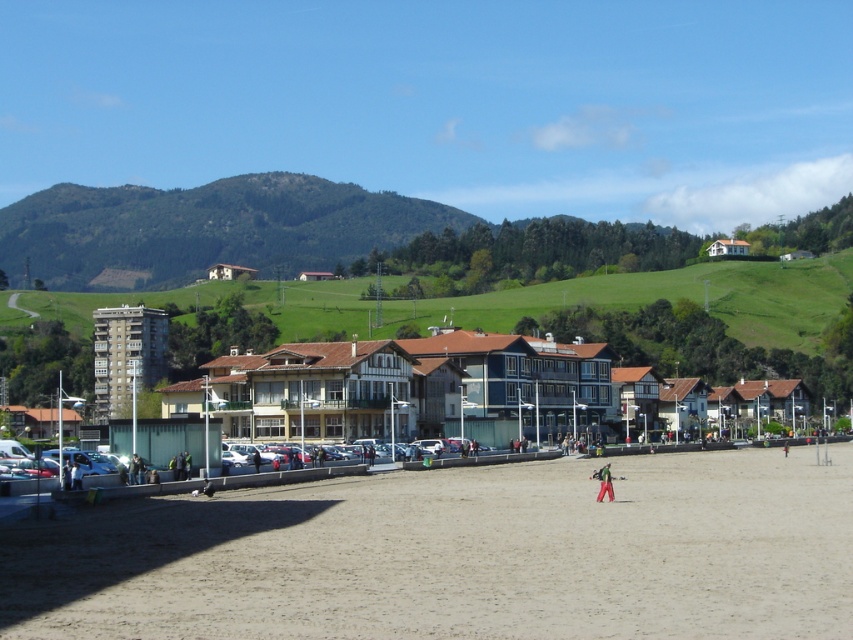
Question: Which point is closer to the camera?

Choices:
 (A) (114, 364)
 (B) (16, 266)
 (C) (618, 516)

Answer: (C)

Question: Can you confirm if green grassy hillside at upper center is bigger than white wooden house at center?

Choices:
 (A) no
 (B) yes

Answer: (B)

Question: Considering the relative positions of light brown sand at center and white wooden house at center in the image provided, where is light brown sand at center located with respect to white wooden house at center?

Choices:
 (A) right
 (B) left

Answer: (B)

Question: Is green grassy hillside at upper center further to the viewer compared to white wooden house at center?

Choices:
 (A) no
 (B) yes

Answer: (B)

Question: Which object is the closest to the brown wooden house at center?

Choices:
 (A) white wooden house at center
 (B) gray concrete building at left
 (C) green grassy hillside at upper center

Answer: (C)

Question: Which object is closer to the camera taking this photo?

Choices:
 (A) gray concrete building at left
 (B) red fabric pants at center
 (C) green grassy hillside at upper center
 (D) white wooden house at center

Answer: (B)